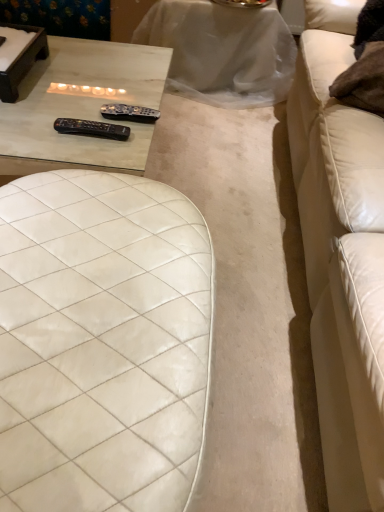
Where is `vacant space to the left of black plastic remote at upper center, marked as the first remote in a back-to-front arrangement`? vacant space to the left of black plastic remote at upper center, marked as the first remote in a back-to-front arrangement is located at coordinates [63, 119].